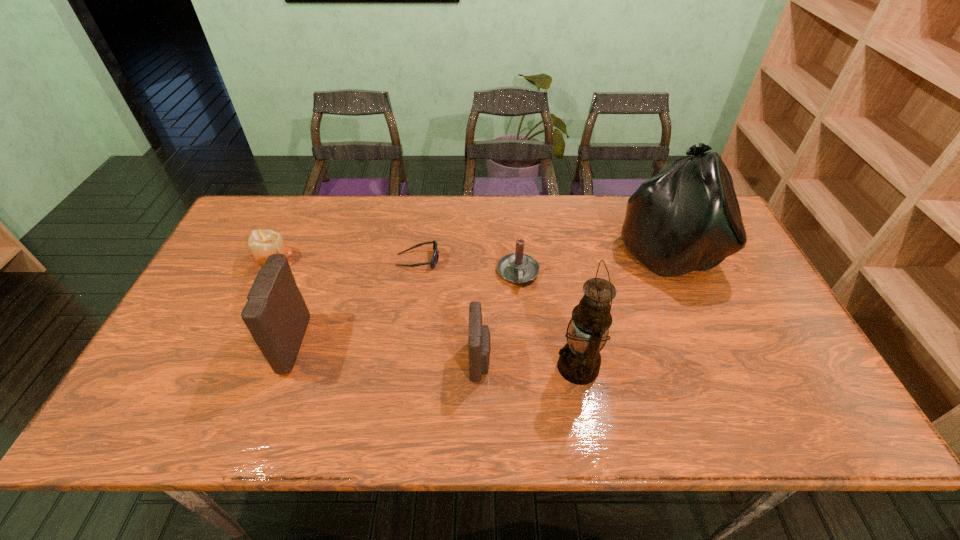
The width and height of the screenshot is (960, 540). Find the location of `vacant area located with an open flap on the taller pouch`. vacant area located with an open flap on the taller pouch is located at coordinates (168, 344).

Locate an element on the screen. vacant area situated with an open flap on the taller pouch is located at coordinates (249, 344).

Where is `vacant space located with an open flap on the taller pouch`? This screenshot has height=540, width=960. vacant space located with an open flap on the taller pouch is located at coordinates (168, 344).

Find the location of `blank space located with an open flap on the right pouch`. blank space located with an open flap on the right pouch is located at coordinates (553, 361).

Identify the location of vacant space situated on the front-facing side of the fifth object from right to left. (476, 260).

What are the coordinates of `free region located 0.330m on the front of the plastic bag` in the screenshot? It's located at (729, 395).

At what (x,y) coordinates should I click in order to perform the action: click on vacant space located on the side of the right candle with the handle loop. Please return your answer as a coordinate pair (x, y). The width and height of the screenshot is (960, 540). Looking at the image, I should click on (522, 319).

You are a GUI agent. You are given a task and a screenshot of the screen. Output one action in this format:
    pyautogui.click(x=<x>, y=<y>)
    Task: Click on the vacant space located on the right of the leftmost object
    
    Given the screenshot: What is the action you would take?
    pyautogui.click(x=325, y=259)

This screenshot has height=540, width=960. I want to click on blank space located 0.160m on the left of the oil lamp, so click(x=489, y=367).

Identify the location of object located in the far edge section of the desktop. (686, 218).